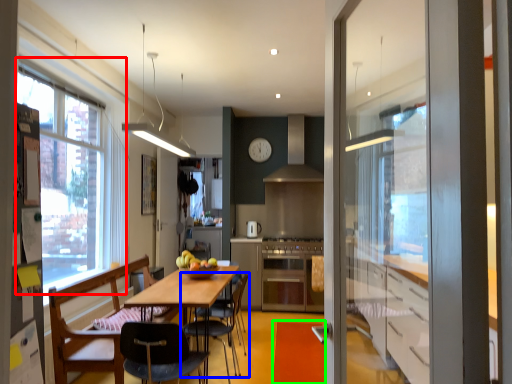
Question: Estimate the real-world distances between objects in this image. Which object is farther from window (highlighted by a red box), chair (highlighted by a blue box) or plain (highlighted by a green box)?

Choices:
 (A) chair
 (B) plain

Answer: (B)